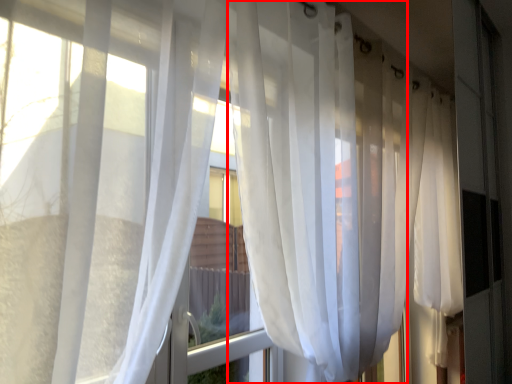
Question: Considering the relative positions of curtain (annotated by the red box) and curtain in the image provided, where is curtain (annotated by the red box) located with respect to the staircase?

Choices:
 (A) left
 (B) right

Answer: (B)